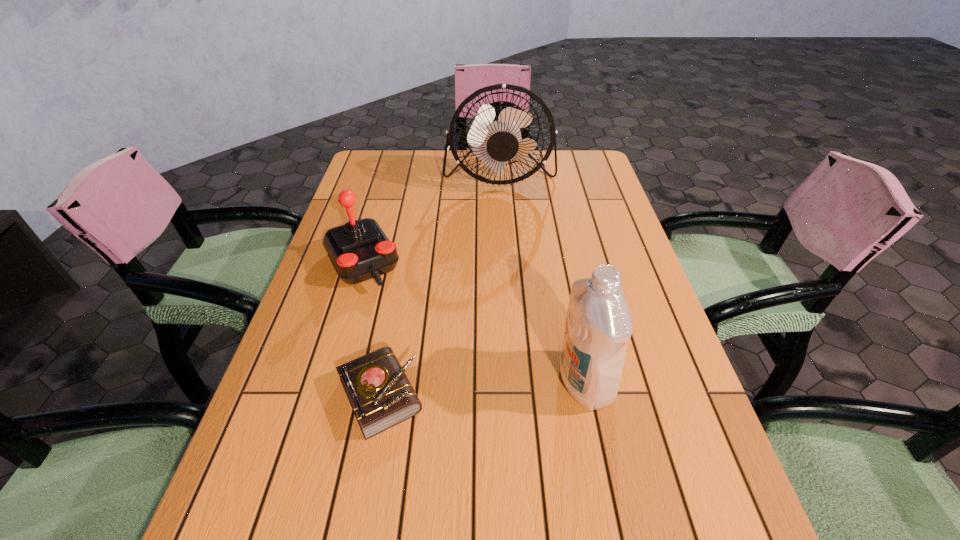
The height and width of the screenshot is (540, 960). Identify the location of joystick at the left edge. (359, 250).

This screenshot has width=960, height=540. Find the location of `diary that is at the left edge`. diary that is at the left edge is located at coordinates (381, 396).

Find the location of a particular element. The width and height of the screenshot is (960, 540). fan that is at the right edge is located at coordinates (498, 134).

Locate an element on the screen. Image resolution: width=960 pixels, height=540 pixels. detergent that is at the right edge is located at coordinates (598, 327).

The height and width of the screenshot is (540, 960). Find the location of `object that is at the far right corner`. object that is at the far right corner is located at coordinates (498, 134).

At what (x,y) coordinates should I click in order to perform the action: click on free space at the far edge. Please return your answer as a coordinate pair (x, y). Looking at the image, I should click on (475, 186).

The width and height of the screenshot is (960, 540). I want to click on vacant space at the left edge of the desktop, so click(x=380, y=214).

I want to click on free space at the right edge, so click(x=623, y=248).

I want to click on free location at the far right corner of the desktop, so click(591, 179).

Where is `vacant space that is in between the shortest object and the second farthest object`? vacant space that is in between the shortest object and the second farthest object is located at coordinates (372, 329).